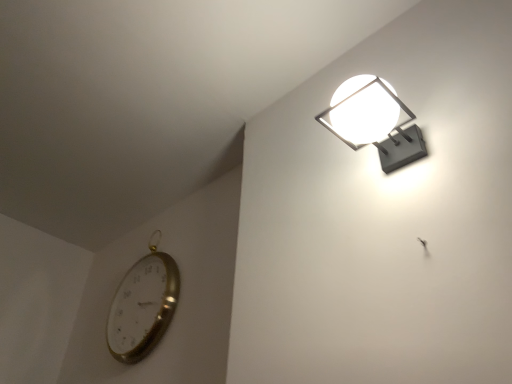
Where is `gold metallic clock at lower left`? This screenshot has width=512, height=384. gold metallic clock at lower left is located at coordinates (143, 307).

What do you see at coordinates (143, 307) in the screenshot?
I see `gold metallic clock at lower left` at bounding box center [143, 307].

Measure the distance between point (424, 143) and camera.

Point (424, 143) and camera are 38.15 inches apart.

Describe the element at coordinates (374, 121) in the screenshot. I see `matte gray wall lamp at upper right` at that location.

What is the approximate height of matte gray wall lamp at upper right?

matte gray wall lamp at upper right is 5.01 inches tall.

The width and height of the screenshot is (512, 384). I want to click on matte gray wall lamp at upper right, so click(374, 121).

You are a GUI agent. You are given a task and a screenshot of the screen. Output one action in this format:
    pyautogui.click(x=<x>, y=<y>)
    Task: Click on the gold metallic clock at lower left
    
    Given the screenshot: What is the action you would take?
    pyautogui.click(x=143, y=307)

Considering the positions of objects gold metallic clock at lower left and matte gray wall lamp at upper right in the image provided, who is more to the right, gold metallic clock at lower left or matte gray wall lamp at upper right?

From the viewer's perspective, matte gray wall lamp at upper right appears more on the right side.

In the scene shown: Considering the positions of objects gold metallic clock at lower left and matte gray wall lamp at upper right in the image provided, who is behind, gold metallic clock at lower left or matte gray wall lamp at upper right?

gold metallic clock at lower left is further away from the camera.

Which is closer, (153, 267) or (374, 110)?

Point (153, 267).

From the image's perspective, does gold metallic clock at lower left appear lower than matte gray wall lamp at upper right?

Yes, from the image's perspective, gold metallic clock at lower left is below matte gray wall lamp at upper right.

From a real-world perspective, is gold metallic clock at lower left over matte gray wall lamp at upper right?

Correct, in the physical world, gold metallic clock at lower left is higher than matte gray wall lamp at upper right.

Which of these two, gold metallic clock at lower left or matte gray wall lamp at upper right, is thinner?

With smaller width is gold metallic clock at lower left.

Consider the image. Can you confirm if gold metallic clock at lower left is taller than matte gray wall lamp at upper right?

Indeed, gold metallic clock at lower left has a greater height compared to matte gray wall lamp at upper right.

Looking at the image, does gold metallic clock at lower left seem bigger or smaller compared to matte gray wall lamp at upper right?

In the image, gold metallic clock at lower left appears to be larger than matte gray wall lamp at upper right.

Is gold metallic clock at lower left not inside matte gray wall lamp at upper right?

Indeed, gold metallic clock at lower left is completely outside matte gray wall lamp at upper right.

Are gold metallic clock at lower left and matte gray wall lamp at upper right located far from each other?

Yes, gold metallic clock at lower left is far from matte gray wall lamp at upper right.

Is gold metallic clock at lower left positioned with its back to matte gray wall lamp at upper right?

That's not correct — gold metallic clock at lower left is not looking away from matte gray wall lamp at upper right.

The image size is (512, 384). I want to click on wall clock above the matte gray wall lamp at upper right (from a real-world perspective), so click(x=143, y=307).

Looking at this image, which object is positioned more to the right, matte gray wall lamp at upper right or gold metallic clock at lower left?

matte gray wall lamp at upper right.

Which is behind, matte gray wall lamp at upper right or gold metallic clock at lower left?

gold metallic clock at lower left is behind.

Is point (404, 137) behind point (140, 273)?

No, it is in front of (140, 273).

From the image's perspective, relative to gold metallic clock at lower left, is matte gray wall lamp at upper right above or below?

matte gray wall lamp at upper right is situated higher than gold metallic clock at lower left in the image.

From a real-world perspective, who is located lower, matte gray wall lamp at upper right or gold metallic clock at lower left?

matte gray wall lamp at upper right is physically lower.

Can you confirm if matte gray wall lamp at upper right is wider than gold metallic clock at lower left?

Yes.

Is matte gray wall lamp at upper right shorter than gold metallic clock at lower left?

Yes, matte gray wall lamp at upper right is shorter than gold metallic clock at lower left.

Which of these two, matte gray wall lamp at upper right or gold metallic clock at lower left, is smaller?

matte gray wall lamp at upper right is smaller.

Is gold metallic clock at lower left surrounded by matte gray wall lamp at upper right?

No, gold metallic clock at lower left is not a part of matte gray wall lamp at upper right.

In the scene shown: Is matte gray wall lamp at upper right directly adjacent to gold metallic clock at lower left?

matte gray wall lamp at upper right is not next to gold metallic clock at lower left, and they're not touching.

Is matte gray wall lamp at upper right positioned with its back to gold metallic clock at lower left?

No, matte gray wall lamp at upper right's orientation is not away from gold metallic clock at lower left.

Identify the location of wall clock above the matte gray wall lamp at upper right (from a real-world perspective). (143, 307).

At what (x,y) coordinates should I click in order to perform the action: click on lamp on the right of gold metallic clock at lower left. Please return your answer as a coordinate pair (x, y). Looking at the image, I should click on click(x=374, y=121).

I want to click on wall clock above the matte gray wall lamp at upper right (from a real-world perspective), so click(x=143, y=307).